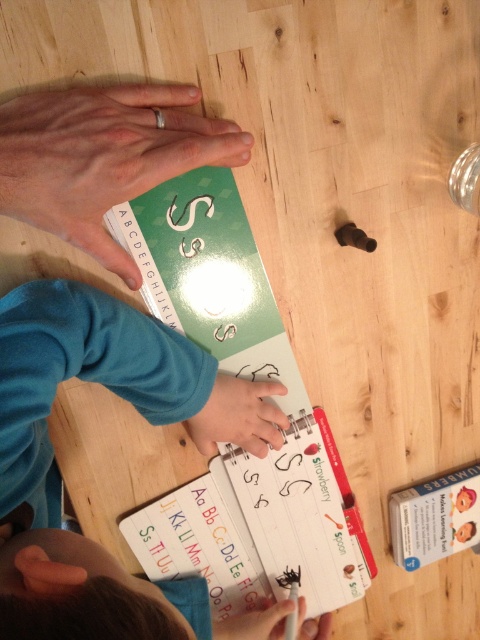
Can you confirm if green paper book at center is positioned above white cardboard book at lower right?

Yes.

Between point (269, 337) and point (396, 522), which one is positioned behind?

The point (396, 522) is more distant.

At what (x,y) coordinates should I click in order to perform the action: click on green paper book at center. Please return your answer as a coordinate pair (x, y). The width and height of the screenshot is (480, 640). Looking at the image, I should click on (251, 380).

Can you confirm if matte white paper at upper center is shorter than matte plastic hand at center?

No, matte white paper at upper center is not shorter than matte plastic hand at center.

Which is behind, point (218, 148) or point (276, 384)?

The point (276, 384) is more distant.

Find the location of a particular element. Image resolution: width=480 pixels, height=640 pixels. matte white paper at upper center is located at coordinates (104, 156).

Is white paper at center to the left of matte white paper at upper center from the viewer's perspective?

Incorrect, white paper at center is not on the left side of matte white paper at upper center.

Which is behind, point (298, 538) or point (206, 156)?

The point (298, 538) is behind.

This screenshot has height=640, width=480. Describe the element at coordinates (264, 525) in the screenshot. I see `white paper at center` at that location.

At what (x,y) coordinates should I click in order to perform the action: click on white paper at center. Please return your answer as a coordinate pair (x, y). Looking at the image, I should click on (264, 525).